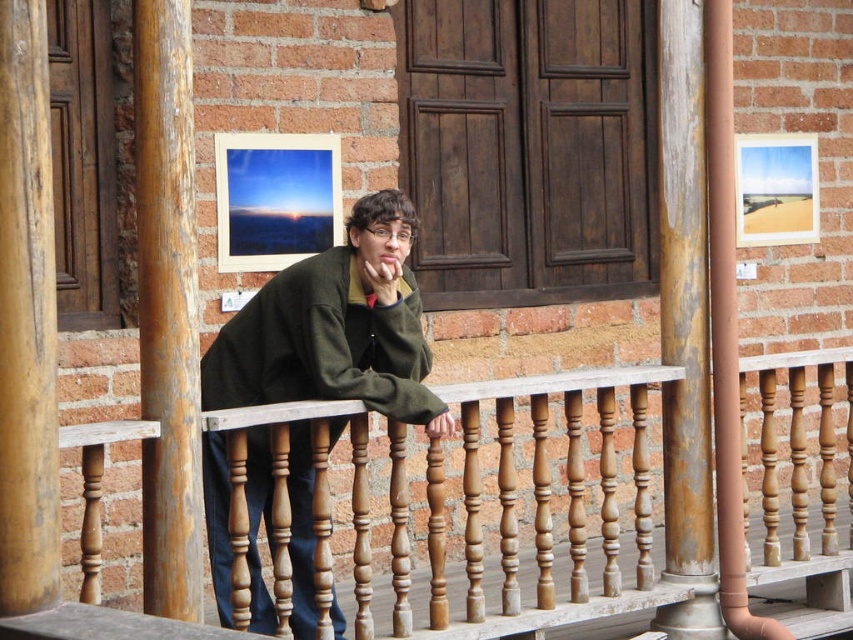
You are a painter who wants to paint the green matte jacket at center and the rusty wood post at center. You have a 6 foot long ladder. Can you safely reach both objects with the ladder?

The green matte jacket at center is 5.68 feet away from the rusty wood post at center. Since the ladder is 6 feet long, you can safely reach both objects as the distance between them is less than the ladder length.

You are standing on the wooden balcony and want to hang a new picture between the two existing framed photographs displayed on the wall. The first photograph is at point [463,400] and the second is at point [376,314]. Which point is closer to you so you can place the new picture there?

Point [463,400] is further to the viewer than point [376,314], so the closer point to you is point [463,400]. Place the new picture there.

You are a carpenter inspecting the balcony structure. You notice two wooden elements at the center of the balcony. One is labeled as wooden at center and the other as rusty wood post at center. Based on the scene, which of these two items has a greater width?

The wooden at center has a greater width than the rusty wood post at center, as stated in the description that wooden at center is wider.